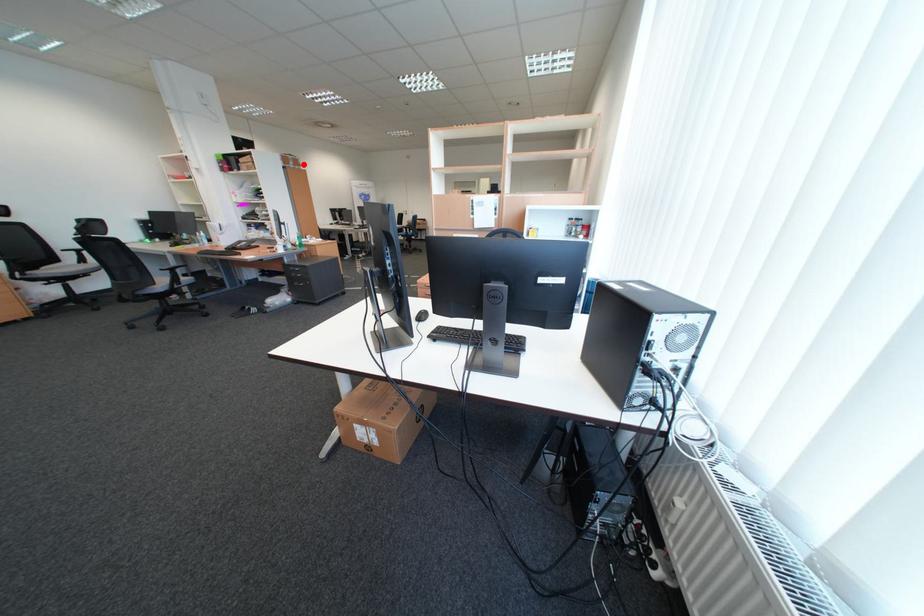
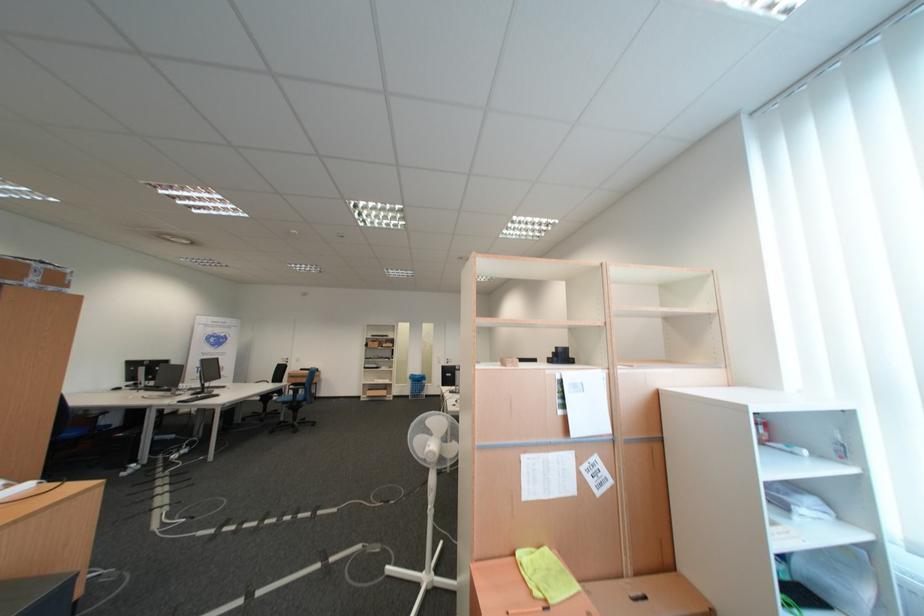
In the second image, find the point that corresponds to the highlighted location in the first image.

(45, 280)